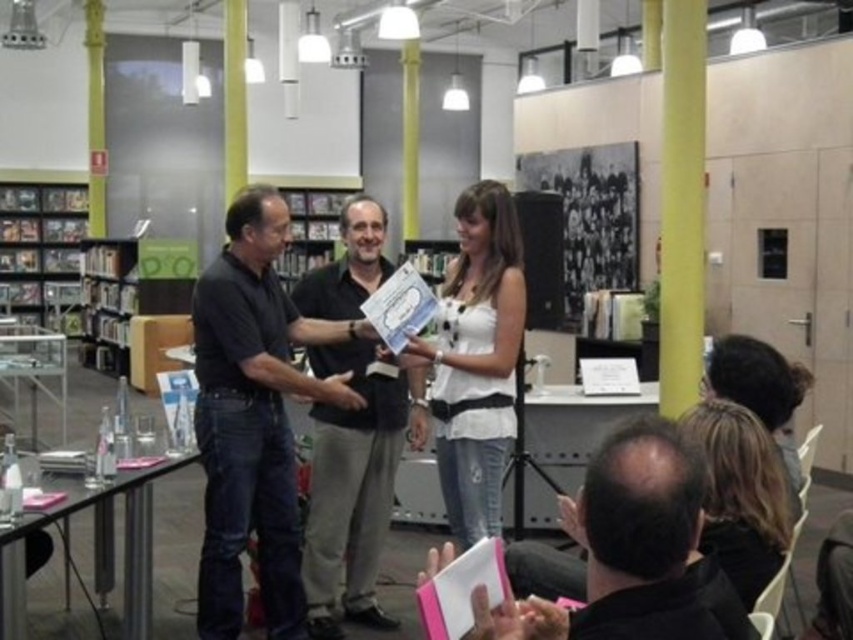
You are a photographer taking a picture of the scene. The white denim jeans at center and the blonde hair at lower right are in the frame. Which object should you focus on first if you want to capture both in sharp focus?

The white denim jeans at center is taller than blonde hair at lower right, so focusing on the white denim jeans at center first would ensure both are in sharp focus since it is larger and closer to the camera.